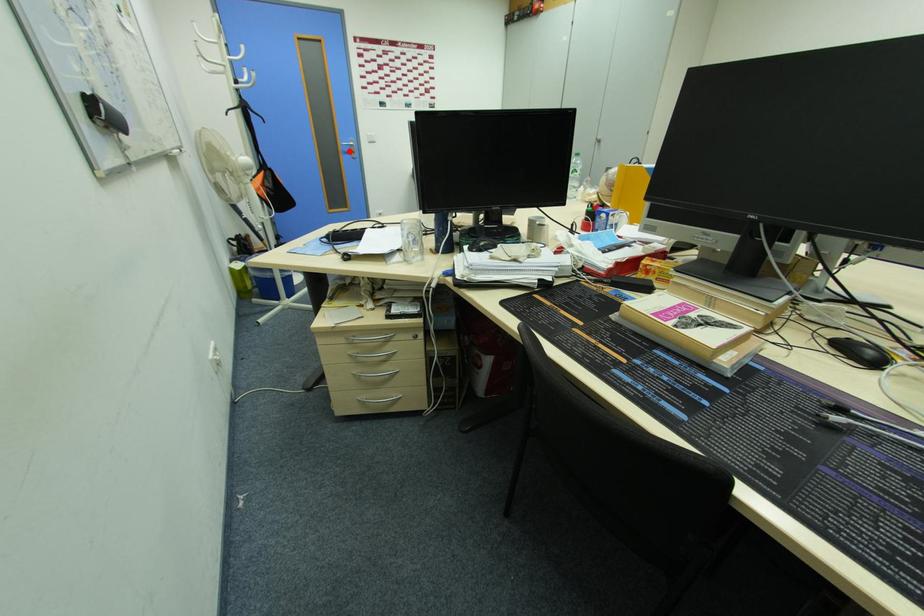
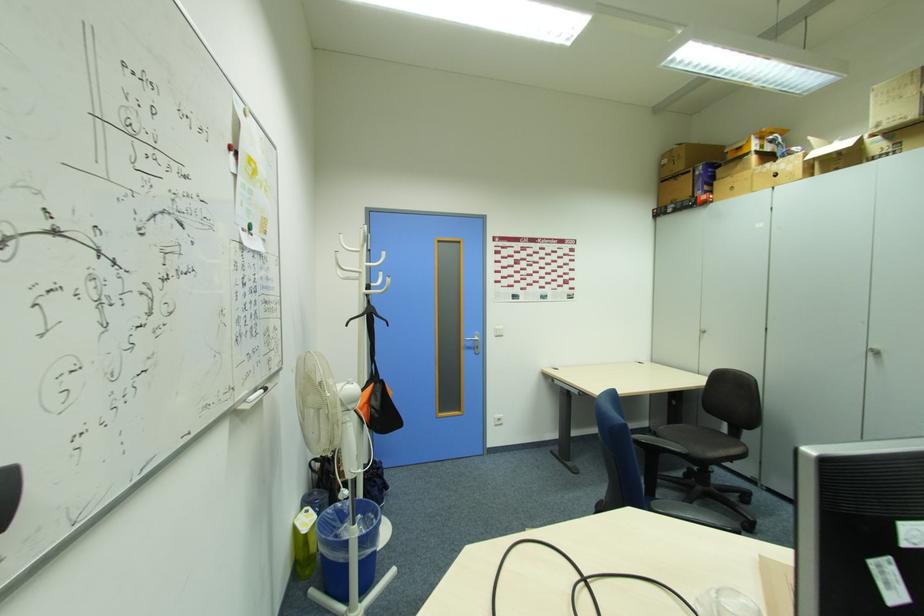
Question: I am providing you with two images of the same scene from different viewpoints. In image1, a red point is highlighted. Considering the same 3D point in image2, which of the following is correct?

Choices:
 (A) It is closer
 (B) It is farther

Answer: (B)